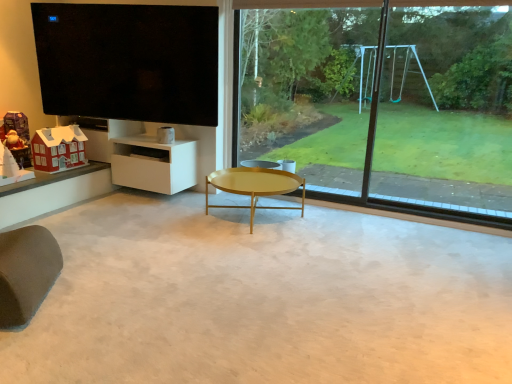
Question: In terms of width, does gold metallic coffee table at center look wider or thinner when compared to brown fabric swivel chair at lower left?

Choices:
 (A) wide
 (B) thin

Answer: (A)

Question: Is gold metallic coffee table at center taller or shorter than brown fabric swivel chair at lower left?

Choices:
 (A) tall
 (B) short

Answer: (B)

Question: Which of these objects is positioned closest to the white matte cabinet at lower left?

Choices:
 (A) matte red house at lower left, marked as the first toy in a right-to-left arrangement
 (B) gold metallic coffee table at center
 (C) matte plastic santa at left, the 1th toy when ordered from left to right
 (D) brown fabric swivel chair at lower left
 (E) black glossy tv at upper left

Answer: (A)

Question: Which is nearer to the brown fabric swivel chair at lower left?

Choices:
 (A) black glass window frame at right
 (B) gold metallic coffee table at center
 (C) matte red house at lower left, the 2th toy in the left-to-right sequence
 (D) white matte cabinet at lower left
 (E) matte plastic santa at left, which is counted as the second toy, starting from the right

Answer: (B)